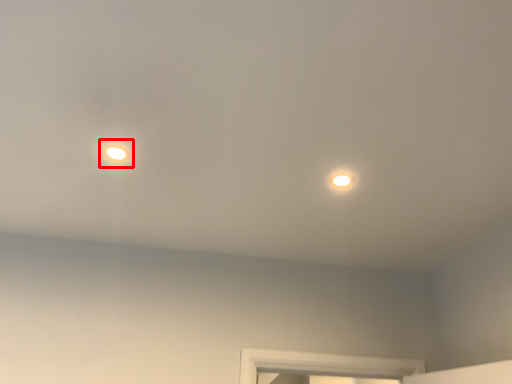
Question: From the image's perspective, what is the correct spatial relationship of droplight (annotated by the red box) in relation to light?

Choices:
 (A) below
 (B) above

Answer: (B)